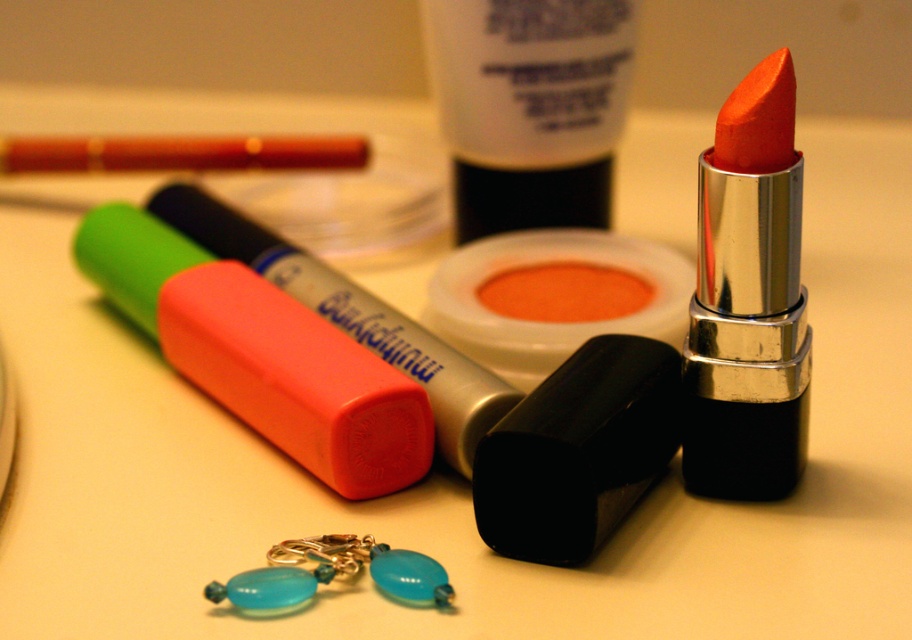
Is matte orange lip balm at center in front of matte orange crayon at upper left?

Yes, matte orange lip balm at center is closer to the viewer.

Does point (488, 250) come farther from viewer compared to point (312, 163)?

No, it is in front of (312, 163).

Identify the location of matte orange lip balm at center. (554, 298).

Identify the location of matte orange lip balm at center. (554, 298).

Between rubberized plastic highlighter at center and matte orange lip balm at center, which one has less height?

matte orange lip balm at center

Does rubberized plastic highlighter at center appear under matte orange lip balm at center?

Yes.

Which is in front, point (167, 237) or point (469, 337)?

Point (469, 337) is in front.

Locate an element on the screen. The width and height of the screenshot is (912, 640). rubberized plastic highlighter at center is located at coordinates (261, 355).

Which is behind, point (768, 240) or point (465, 321)?

Point (465, 321)

Does point (701, 378) come behind point (430, 280)?

No, it is not.

Between point (691, 488) and point (578, 266), which one is positioned behind?

Point (578, 266)

Identify the location of orange matte lipstick at center. This screenshot has width=912, height=640. (748, 300).